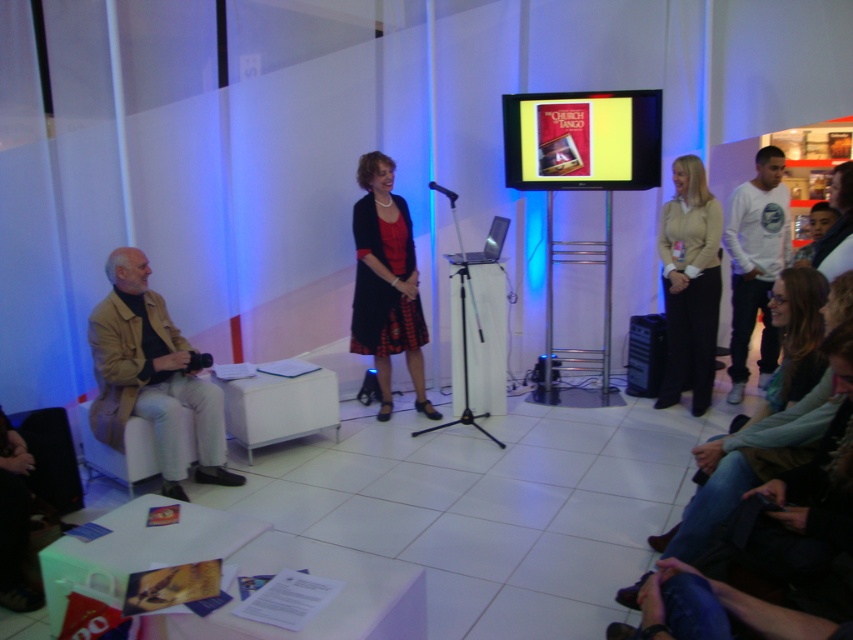
Is matte black dress at center smaller than white cotton shirt at right?

Correct, matte black dress at center occupies less space than white cotton shirt at right.

Locate an element on the screen. Image resolution: width=853 pixels, height=640 pixels. matte black dress at center is located at coordinates (386, 284).

Identify the location of matte black dress at center. (386, 284).

Does beige fabric jacket at left have a lesser height compared to white cotton shirt at right?

Yes, beige fabric jacket at left is shorter than white cotton shirt at right.

Does beige fabric jacket at left have a larger size compared to white cotton shirt at right?

Actually, beige fabric jacket at left might be smaller than white cotton shirt at right.

Which is in front, point (129, 384) or point (764, 180)?

Point (129, 384)

Find the location of a particular element. The image size is (853, 640). beige fabric jacket at left is located at coordinates (152, 378).

Who is more distant from viewer, (694, 237) or (25, 428)?

Positioned behind is point (694, 237).

Consider the image. Does beige fabric pants at right have a greater width compared to matte black jacket at lower left?

Indeed, beige fabric pants at right has a greater width compared to matte black jacket at lower left.

Locate an element on the screen. beige fabric pants at right is located at coordinates (689, 284).